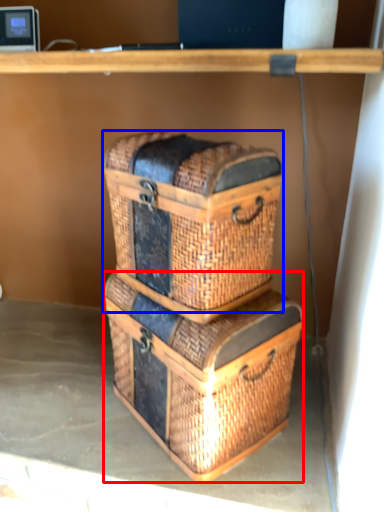
Question: Which object is further to the camera taking this photo, crate (highlighted by a red box) or basket container (highlighted by a blue box)?

Choices:
 (A) crate
 (B) basket container

Answer: (A)